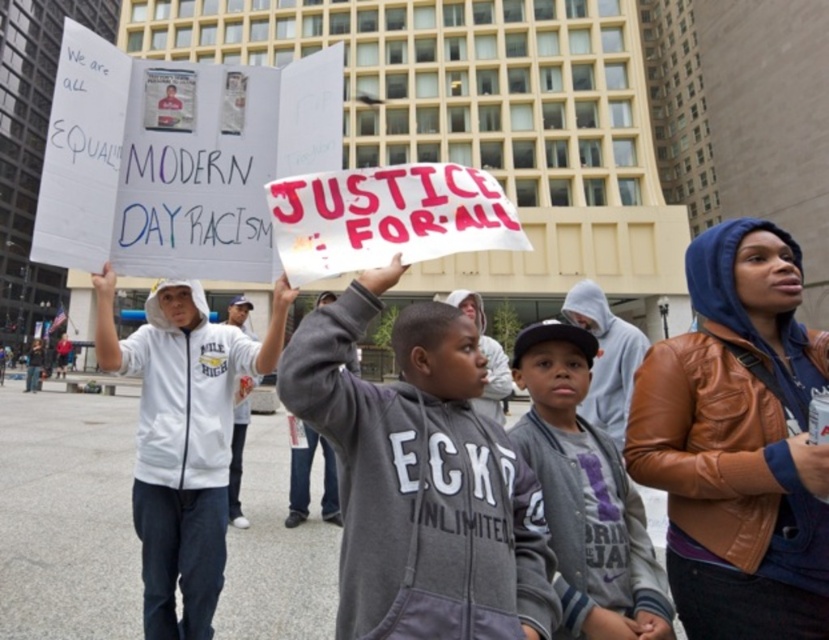
Question: Is brown leather jacket at center above gray fleece sweatshirt at center?

Choices:
 (A) yes
 (B) no

Answer: (A)

Question: Observing the image, what is the correct spatial positioning of gray fleece sweatshirt at center in reference to white hoodie at center?

Choices:
 (A) right
 (B) left

Answer: (A)

Question: Among these points, which one is farthest from the camera?

Choices:
 (A) (196, 336)
 (B) (463, 588)
 (C) (561, 346)

Answer: (A)

Question: Estimate the real-world distances between objects in this image. Which object is closer to the brown leather jacket at center?

Choices:
 (A) white hoodie at center
 (B) gray fleece sweatshirt at center
 (C) gray fleece jacket at center

Answer: (C)

Question: From the image, what is the correct spatial relationship of white hoodie at center in relation to gray fleece jacket at center?

Choices:
 (A) above
 (B) below

Answer: (B)

Question: Which object is the farthest from the gray fleece sweatshirt at center?

Choices:
 (A) brown leather jacket at center
 (B) gray fleece jacket at center
 (C) white hoodie at center

Answer: (C)